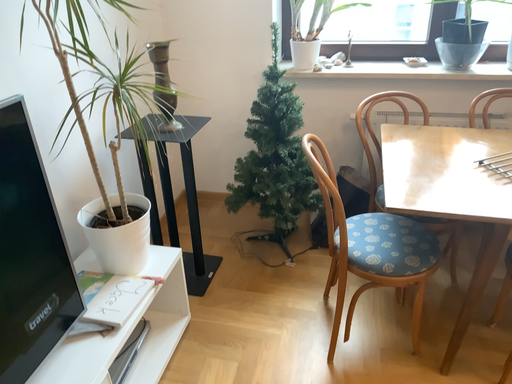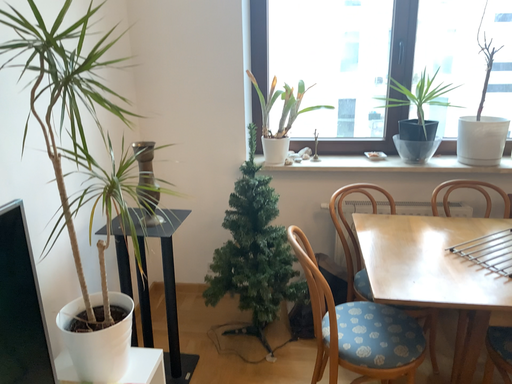
Question: How did the camera likely rotate when shooting the video?

Choices:
 (A) rotated upward
 (B) rotated downward

Answer: (A)